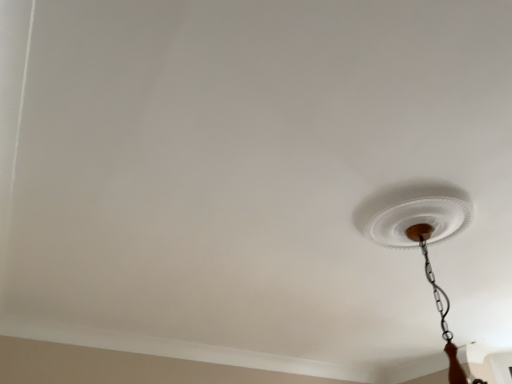
What is the approximate height of white plastic lamp at upper right?

white plastic lamp at upper right is 23.92 inches tall.

What is the approximate width of white plastic lamp at upper right?

22.02 inches.

This screenshot has width=512, height=384. Describe the element at coordinates (419, 234) in the screenshot. I see `white plastic lamp at upper right` at that location.

In order to face white plastic lamp at upper right, should I rotate leftwards or rightwards?

To face it directly, rotate right by 24.014 degrees.

Find the location of `white plastic lamp at upper right`. white plastic lamp at upper right is located at coordinates (419, 234).

This screenshot has width=512, height=384. In order to click on white plastic lamp at upper right in this screenshot , I will do `click(419, 234)`.